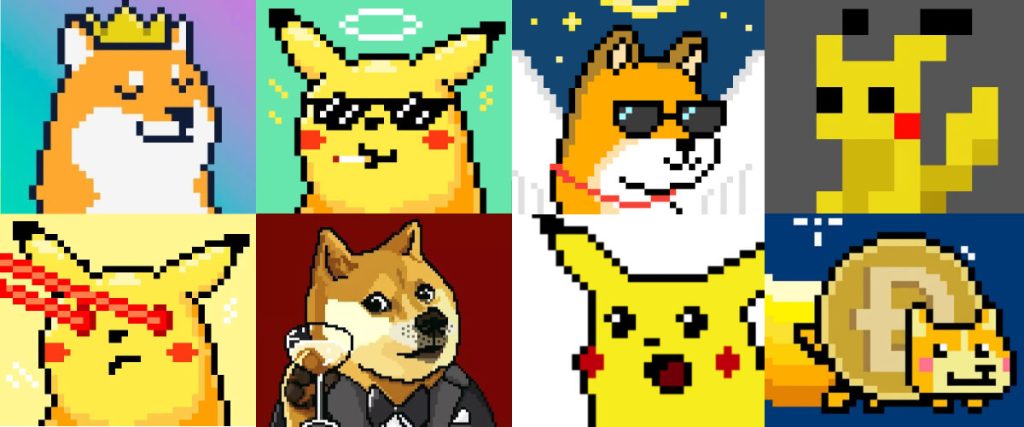
Find the location of `champagne glass`. champagne glass is located at coordinates (329, 339).